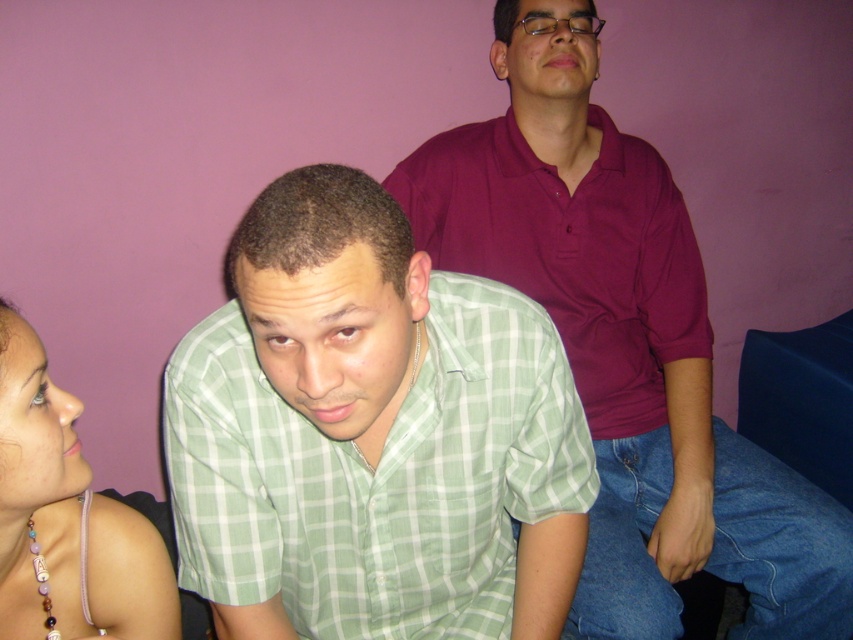
Consider the image. Does matte green shirt at center appear on the right side of pearl necklace at upper left?

Correct, you'll find matte green shirt at center to the right of pearl necklace at upper left.

How distant is matte green shirt at center from pearl necklace at upper left?

matte green shirt at center and pearl necklace at upper left are 29.53 inches apart.

Who is more forward, [653,301] or [157,625]?

Point [157,625]

Locate an element on the screen. matte green shirt at center is located at coordinates (624, 342).

Can you confirm if matte green shirt at center is positioned to the left of maroon cotton shirt at upper center?

In fact, matte green shirt at center is to the right of maroon cotton shirt at upper center.

Is matte green shirt at center further to camera compared to maroon cotton shirt at upper center?

That is False.

I want to click on matte green shirt at center, so click(x=624, y=342).

You are a GUI agent. You are given a task and a screenshot of the screen. Output one action in this format:
    pyautogui.click(x=<x>, y=<y>)
    Task: Click on the matte green shirt at center
    
    Given the screenshot: What is the action you would take?
    pyautogui.click(x=624, y=342)

Does point (274, 372) come farther from viewer compared to point (131, 579)?

No, it is not.

From the picture: Is green checkered shirt at center above pearl necklace at upper left?

Correct, green checkered shirt at center is located above pearl necklace at upper left.

Where is `green checkered shirt at center`? green checkered shirt at center is located at coordinates (370, 435).

The width and height of the screenshot is (853, 640). Identify the location of green checkered shirt at center. (370, 435).